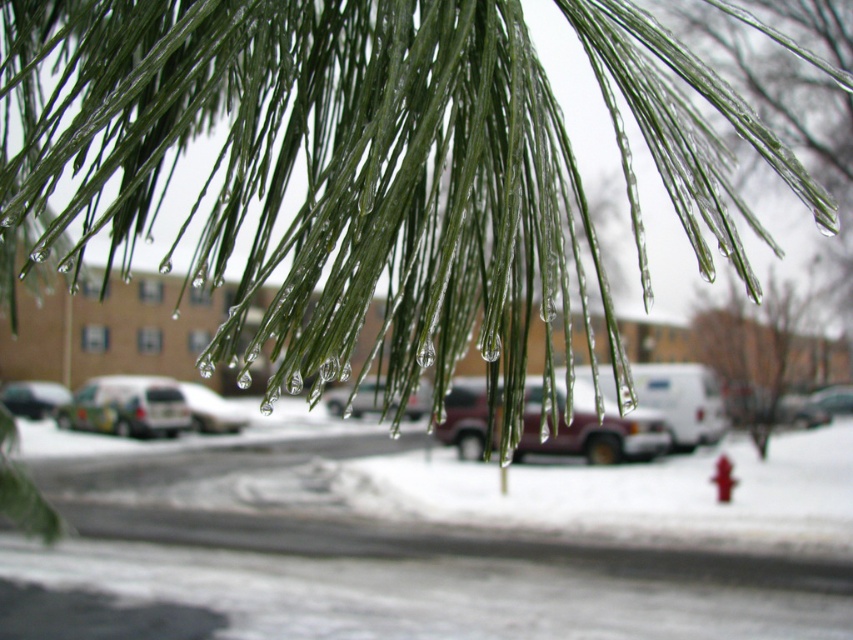
Between point (213, 410) and point (730, 486), which one is positioned behind?

The point (730, 486) is behind.

Is white matte car at center shorter than red plastic hydrant at lower right?

Yes, white matte car at center is shorter than red plastic hydrant at lower right.

Where is `white matte car at center`? white matte car at center is located at coordinates (212, 410).

Does white matte van at lower left have a greater width compared to red plastic hydrant at lower right?

Yes.

Which of these two, white matte van at lower left or red plastic hydrant at lower right, stands shorter?

With less height is red plastic hydrant at lower right.

Does point (158, 433) come farther from viewer compared to point (711, 481)?

No, (158, 433) is in front of (711, 481).

Locate an element on the screen. Image resolution: width=853 pixels, height=640 pixels. white matte van at lower left is located at coordinates (126, 406).

Can you confirm if green glossy pine needles at upper center is positioned above white matte van at lower left?

Correct, green glossy pine needles at upper center is located above white matte van at lower left.

This screenshot has height=640, width=853. What do you see at coordinates (316, 172) in the screenshot?
I see `green glossy pine needles at upper center` at bounding box center [316, 172].

Find the location of a particular element. Image resolution: width=853 pixels, height=640 pixels. green glossy pine needles at upper center is located at coordinates (316, 172).